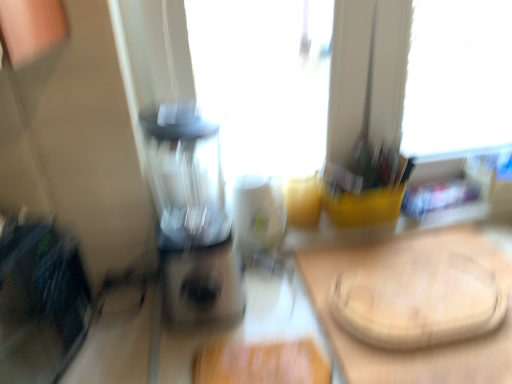
This screenshot has width=512, height=384. Find the location of `free space above wooden cutting board at center (from a real-world perspective)`. free space above wooden cutting board at center (from a real-world perspective) is located at coordinates (423, 311).